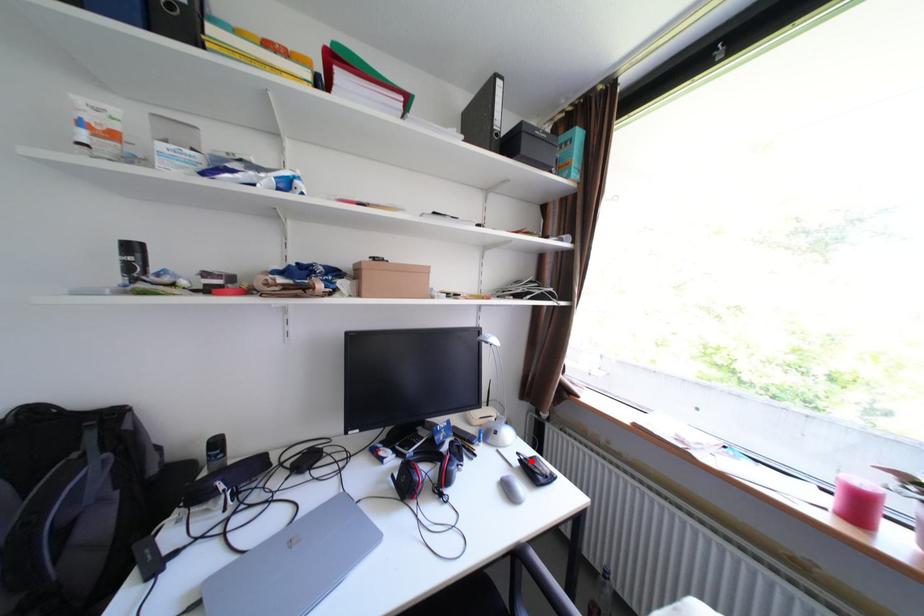
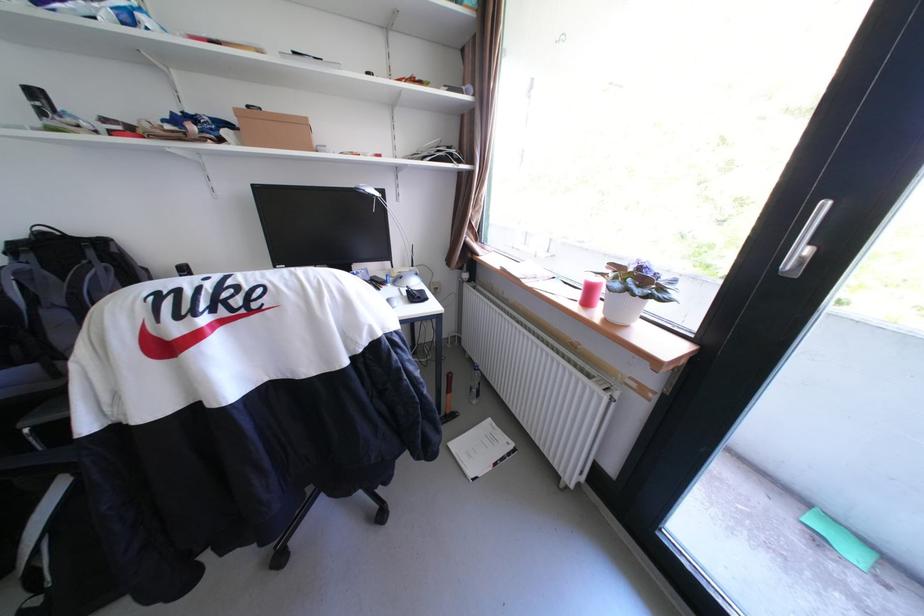
Find the pixel in the second image that matches the highlighted location in the first image.

(418, 291)